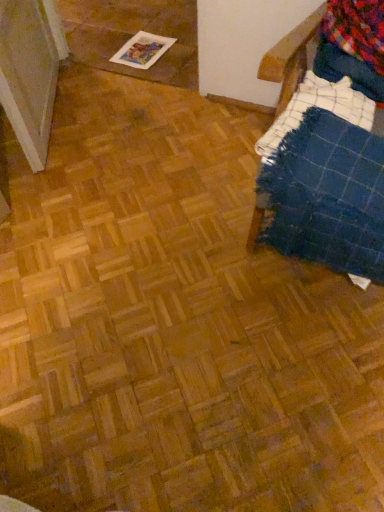
Locate an element on the screen. The height and width of the screenshot is (512, 384). multicolored flannel at upper right is located at coordinates (357, 30).

Where is `blue plaid blanket at right`? This screenshot has height=512, width=384. blue plaid blanket at right is located at coordinates (354, 49).

Is the depth of blue plaid blanket at right less than that of multicolored flannel at upper right?

That is True.

In terms of height, does blue plaid blanket at right look taller or shorter compared to multicolored flannel at upper right?

In the image, blue plaid blanket at right appears to be taller than multicolored flannel at upper right.

From the image's perspective, is blue plaid blanket at right on top of multicolored flannel at upper right?

No, from the image's perspective, blue plaid blanket at right is not over multicolored flannel at upper right.

How much distance is there between blue plaid blanket at right and multicolored flannel at upper right?

blue plaid blanket at right is 7.17 centimeters from multicolored flannel at upper right.

From the image's perspective, would you say multicolored flannel at upper right is positioned over printed paper magazine at upper left?

Actually, multicolored flannel at upper right appears below printed paper magazine at upper left in the image.

Is multicolored flannel at upper right thinner than printed paper magazine at upper left?

Yes, multicolored flannel at upper right is thinner than printed paper magazine at upper left.

Are multicolored flannel at upper right and printed paper magazine at upper left making contact?

No, multicolored flannel at upper right is not touching printed paper magazine at upper left.

Can you tell me how much multicolored flannel at upper right and blue plaid blanket at right differ in facing direction?

4.07 degrees separate the facing orientations of multicolored flannel at upper right and blue plaid blanket at right.

Does multicolored flannel at upper right come in front of blue plaid blanket at right?

No, multicolored flannel at upper right is further to the viewer.

Can you confirm if multicolored flannel at upper right is positioned to the right of blue plaid blanket at right?

No, multicolored flannel at upper right is not to the right of blue plaid blanket at right.

Based on the photo, considering the relative sizes of multicolored flannel at upper right and blue plaid blanket at right in the image provided, is multicolored flannel at upper right bigger than blue plaid blanket at right?

No, multicolored flannel at upper right is not bigger than blue plaid blanket at right.

Consider the image. Is printed paper magazine at upper left positioned beyond the bounds of blue plaid blanket at right?

printed paper magazine at upper left is positioned outside blue plaid blanket at right.

Is printed paper magazine at upper left positioned with its back to blue plaid blanket at right?

printed paper magazine at upper left is not turned away from blue plaid blanket at right.

Measure the distance from printed paper magazine at upper left to blue plaid blanket at right.

A distance of 3.69 feet exists between printed paper magazine at upper left and blue plaid blanket at right.

Who is more distant, printed paper magazine at upper left or blue plaid blanket at right?

Positioned behind is printed paper magazine at upper left.

From the image's perspective, which is above, blue plaid blanket at right or printed paper magazine at upper left?

printed paper magazine at upper left, from the image's perspective.

Is blue plaid blanket at right situated inside printed paper magazine at upper left or outside?

blue plaid blanket at right exists outside the volume of printed paper magazine at upper left.

Is blue plaid blanket at right far away from printed paper magazine at upper left?

Indeed, blue plaid blanket at right is not near printed paper magazine at upper left.

Considering the relative sizes of blue plaid blanket at right and printed paper magazine at upper left in the image provided, is blue plaid blanket at right thinner than printed paper magazine at upper left?

No, blue plaid blanket at right is not thinner than printed paper magazine at upper left.

At what (x,y) coordinates should I click in order to perform the action: click on flannel in front of the printed paper magazine at upper left. Please return your answer as a coordinate pair (x, y). This screenshot has height=512, width=384. Looking at the image, I should click on (357, 30).

From the image's perspective, is printed paper magazine at upper left located beneath multicolored flannel at upper right?

Actually, printed paper magazine at upper left appears above multicolored flannel at upper right in the image.

Looking at this image, can you confirm if printed paper magazine at upper left is taller than multicolored flannel at upper right?

In fact, printed paper magazine at upper left may be shorter than multicolored flannel at upper right.

Find the location of a particular element. The width and height of the screenshot is (384, 512). flannel on the left of the blue plaid blanket at right is located at coordinates (357, 30).

I want to click on magazine below the multicolored flannel at upper right (from a real-world perspective), so (x=142, y=50).

Based on their spatial positions, is printed paper magazine at upper left or multicolored flannel at upper right closer to blue plaid blanket at right?

multicolored flannel at upper right is positioned closer to the anchor blue plaid blanket at right.

Which object lies further to the anchor point multicolored flannel at upper right, blue plaid blanket at right or printed paper magazine at upper left?

printed paper magazine at upper left lies further to multicolored flannel at upper right than the other object.

From the image, which object appears to be nearer to blue plaid blanket at right, multicolored flannel at upper right or printed paper magazine at upper left?

Among the two, multicolored flannel at upper right is located nearer to blue plaid blanket at right.

Looking at the image, which one is located closer to printed paper magazine at upper left, blue plaid blanket at right or multicolored flannel at upper right?

The object closer to printed paper magazine at upper left is multicolored flannel at upper right.

Looking at the image, which one is located further to printed paper magazine at upper left, multicolored flannel at upper right or blue plaid blanket at right?

The object further to printed paper magazine at upper left is blue plaid blanket at right.

Consider the image. From the image, which object appears to be farther from multicolored flannel at upper right, printed paper magazine at upper left or blue plaid blanket at right?

printed paper magazine at upper left lies further to multicolored flannel at upper right than the other object.

Find the location of `flannel between blue plaid blanket at right and printed paper magazine at upper left in the front-back direction`. flannel between blue plaid blanket at right and printed paper magazine at upper left in the front-back direction is located at coordinates (357, 30).